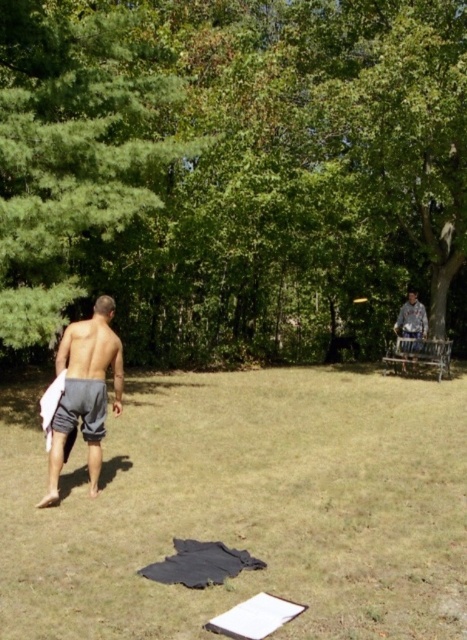
Based on the photo, you are standing in the backyard and want to walk from the gray cotton shorts at left to the green leafy tree at left. Which direction should you go to reach the tree without passing through the tree itself?

The green leafy tree at left is further to the viewer than the gray cotton shorts at left, so you should walk forward towards the tree since it is closer to you than the shorts.

You are standing in the backyard and want to plant a new flower bed. The instructions say to place it under the green leafy tree at left. Where should you look to find the location for the flower bed?

The green leafy tree at left is located at point (70,154), so you should look there to place the flower bed.

You are standing in the backyard and see the green leafy tree at left and the gray cotton shorts at lower left. Which object is closer to you?

The gray cotton shorts at lower left is behind the green leafy tree at left, so the green leafy tree at left is closer to you.